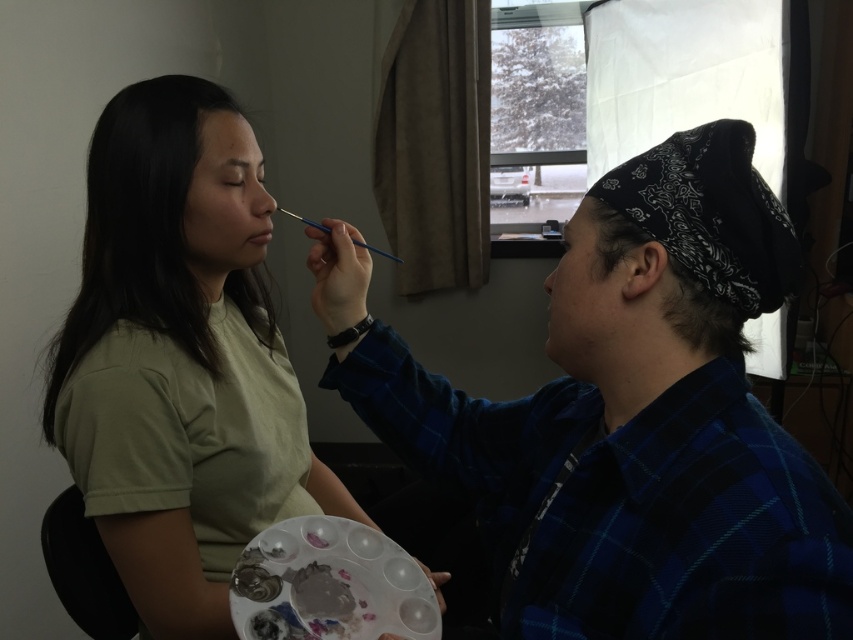
You are a makeup artist who needs to hand a makeup brush to the person wearing the blue plaid shirt at right. If your outstretched arm can reach 50 centimeters, will you be able to hand it directly without moving closer?

The blue plaid shirt at right and the viewer are 49.27 centimeters apart from each other. Since your arm can reach 50 centimeters, you can hand the brush directly without moving closer.

Based on the scene description, where is the matte black bandana at right located in terms of coordinates?

The matte black bandana at right is located at point coordinates of (589, 296).

You are a makeup artist standing 60 centimeters away from the matte black bandana at right. Can you safely reach the bandana without moving closer?

The distance between the matte black bandana at right and the viewer is 66.55 centimeters. Since you are currently 60 centimeters away, you are still 6.55 centimeters too far to reach it without moving closer.